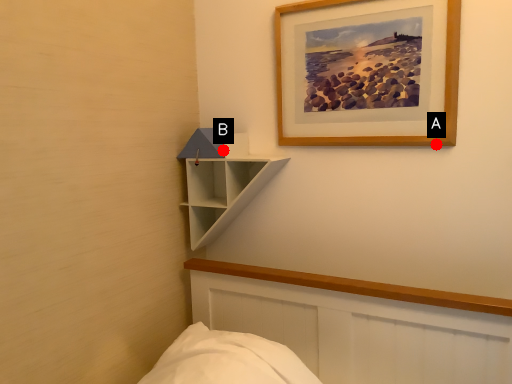
Question: Two points are circled on the image, labeled by A and B beside each circle. Which of the following is the closest to the observer?

Choices:
 (A) A is closer
 (B) B is closer

Answer: (A)